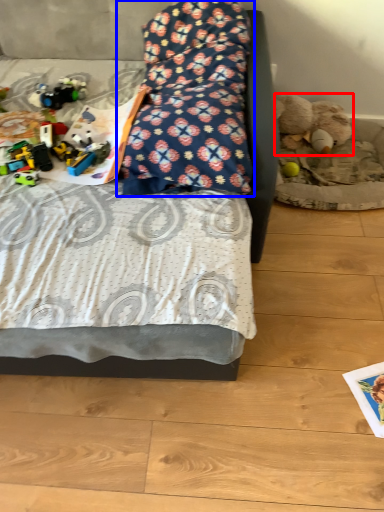
Question: Which of the following is the farthest to the observer, teddy bear (highlighted by a red box) or pillow (highlighted by a blue box)?

Choices:
 (A) teddy bear
 (B) pillow

Answer: (A)